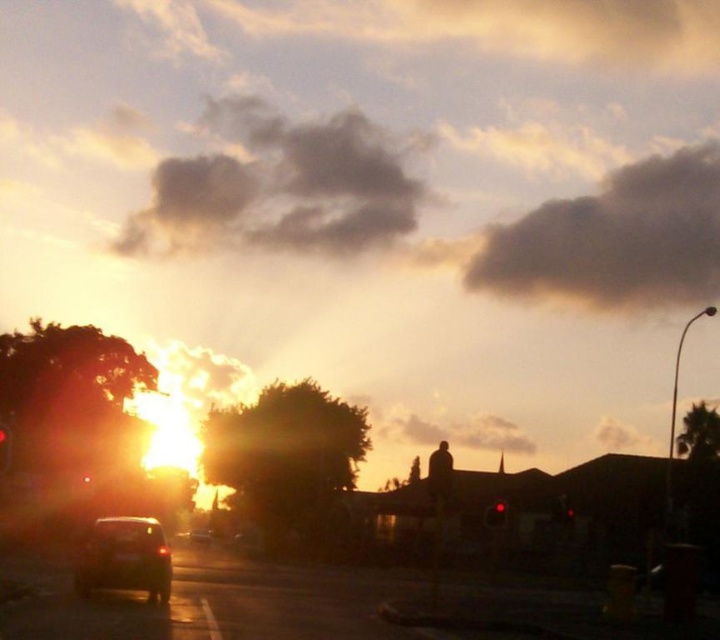
Question: Which of the following is the closest to the observer?

Choices:
 (A) red glass traffic light at lower left
 (B) shiny black car at lower left

Answer: (A)

Question: Observing the image, what is the correct spatial positioning of fuzzy white cloud at upper center in reference to red glass traffic light at center?

Choices:
 (A) above
 (B) below

Answer: (B)

Question: Can you confirm if fuzzy white cloud at upper center is positioned to the left of red glass traffic light at center?

Choices:
 (A) yes
 (B) no

Answer: (B)

Question: Which point is farther to the camera?

Choices:
 (A) pos(140,588)
 (B) pos(693,244)

Answer: (B)

Question: Which point appears closest to the camera in this image?

Choices:
 (A) (9, 448)
 (B) (341, 248)
 (C) (490, 528)
 (D) (86, 540)

Answer: (A)

Question: Can you confirm if shiny black car at lower left is wider than shiny silver car at center?

Choices:
 (A) no
 (B) yes

Answer: (B)